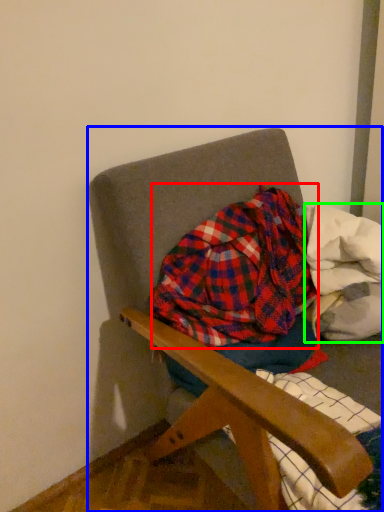
Question: Estimate the real-world distances between objects in this image. Which object is closer to flannel (highlighted by a red box), chair (highlighted by a blue box) or material (highlighted by a green box)?

Choices:
 (A) chair
 (B) material

Answer: (B)